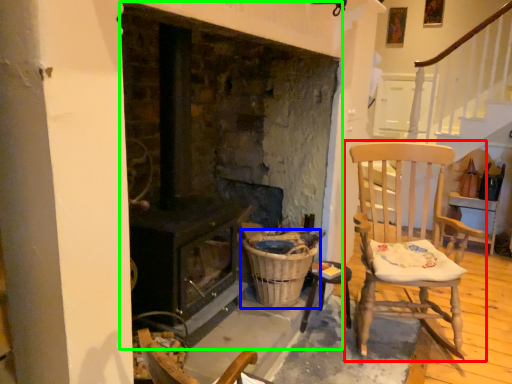
Question: Which object is positioned closest to chair (highlighted by a red box)? Select from basket (highlighted by a blue box) and fireplace (highlighted by a green box).

Choices:
 (A) basket
 (B) fireplace

Answer: (A)